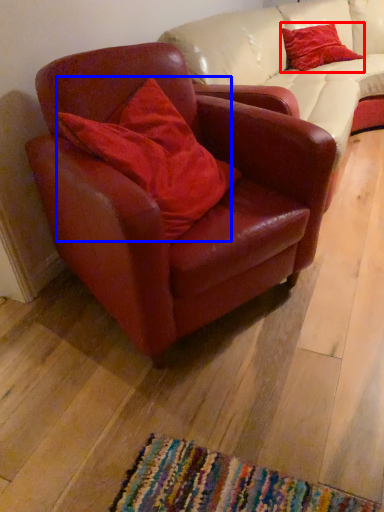
Question: Among these objects, which one is nearest to the camera, pillow (highlighted by a red box) or pillow (highlighted by a blue box)?

Choices:
 (A) pillow
 (B) pillow

Answer: (B)